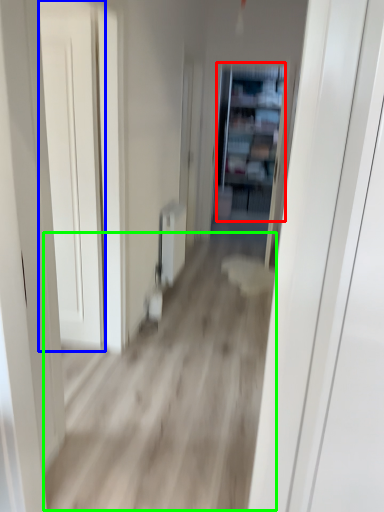
Question: Which object is the farthest from bookshelf (highlighted by a red box)? Choose among these: door (highlighted by a blue box) or corridor (highlighted by a green box).

Choices:
 (A) door
 (B) corridor

Answer: (A)